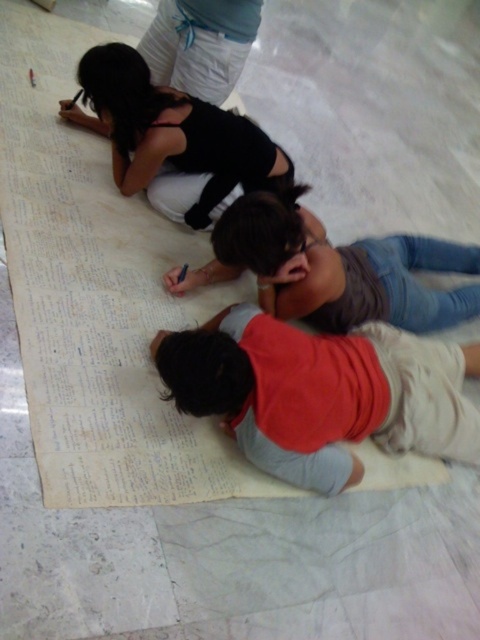
Between point (418, 321) and point (229, 132), which one is positioned in front?

Positioned in front is point (229, 132).

Does matte gray shirt at center have a greater height compared to matte black top at upper left?

Incorrect, matte gray shirt at center's height is not larger of matte black top at upper left's.

Between point (231, 253) and point (230, 176), which one is positioned in front?

Positioned in front is point (231, 253).

At what (x,y) coordinates should I click in order to perform the action: click on matte gray shirt at center. Please return your answer as a coordinate pair (x, y). Looking at the image, I should click on (334, 269).

Which is behind, point (395, 397) or point (409, 321)?

The point (409, 321) is behind.

Is point (259, 321) positioned behind point (280, 250)?

That is False.

Identify the location of red cotton shirt at lower center. (340, 396).

Which is below, red cotton shirt at lower center or matte black top at upper left?

Positioned lower is red cotton shirt at lower center.

Does red cotton shirt at lower center appear on the right side of matte black top at upper left?

Yes, red cotton shirt at lower center is to the right of matte black top at upper left.

Image resolution: width=480 pixels, height=640 pixels. What do you see at coordinates (340, 396) in the screenshot?
I see `red cotton shirt at lower center` at bounding box center [340, 396].

This screenshot has height=640, width=480. Identify the location of red cotton shirt at lower center. (340, 396).